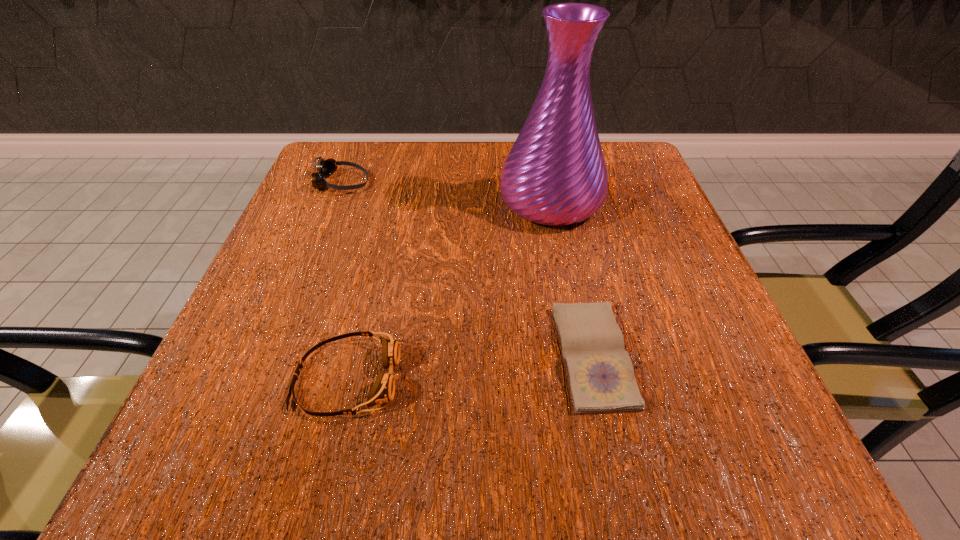
Image resolution: width=960 pixels, height=540 pixels. I want to click on vase, so click(555, 174).

Where is `the farther goggles`? The height and width of the screenshot is (540, 960). the farther goggles is located at coordinates (325, 168).

The height and width of the screenshot is (540, 960). Identify the location of the nearer goggles. (383, 390).

You are a GUI agent. You are given a task and a screenshot of the screen. Output one action in this format:
    pyautogui.click(x=<x>, y=<y>)
    Task: Click on the shortest object
    This screenshot has height=540, width=960.
    Given the screenshot: What is the action you would take?
    coord(601,377)

At what (x,y) coordinates should I click in order to perform the action: click on vacant space located 0.060m on the left of the tallest object. Please return your answer as a coordinate pair (x, y). The width and height of the screenshot is (960, 540). Looking at the image, I should click on (468, 201).

Locate an element on the screen. Image resolution: width=960 pixels, height=540 pixels. vacant region located 0.340m through the lenses of the farther goggles is located at coordinates (531, 183).

The height and width of the screenshot is (540, 960). Find the location of `free location located with the lenses facing forward on the nearer goggles`. free location located with the lenses facing forward on the nearer goggles is located at coordinates (458, 379).

Identify the location of vacant area located on the back of the shortest object. (569, 244).

Image resolution: width=960 pixels, height=540 pixels. Find the location of `vase present at the far edge`. vase present at the far edge is located at coordinates (555, 174).

This screenshot has height=540, width=960. I want to click on goggles positioned at the far edge, so click(x=325, y=168).